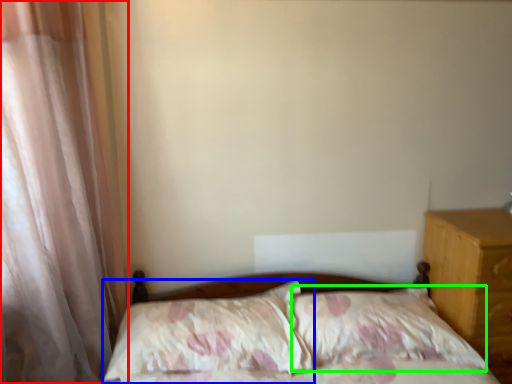
Question: Which object is the farthest from curtain (highlighted by a red box)? Choose among these: pillow (highlighted by a blue box) or pillow (highlighted by a green box).

Choices:
 (A) pillow
 (B) pillow

Answer: (B)